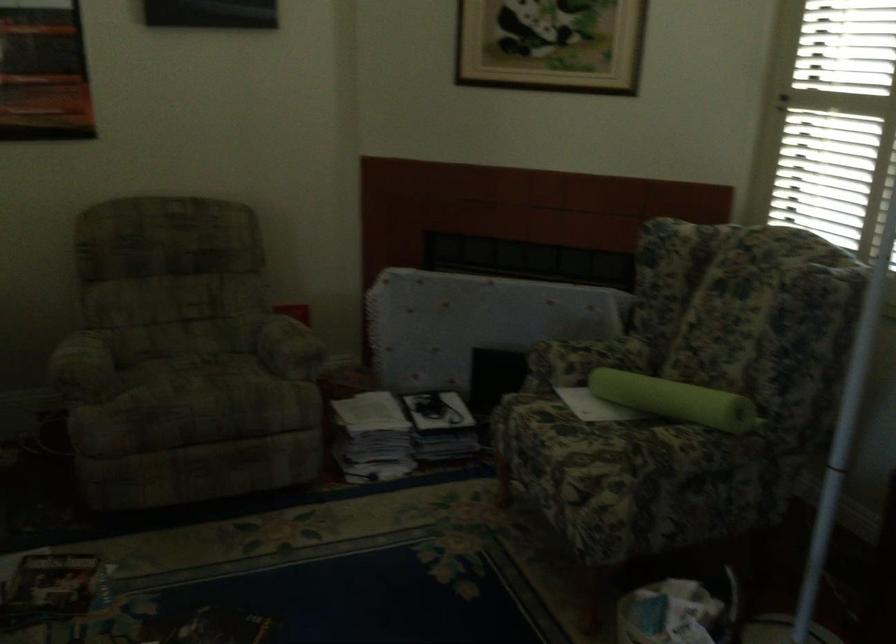
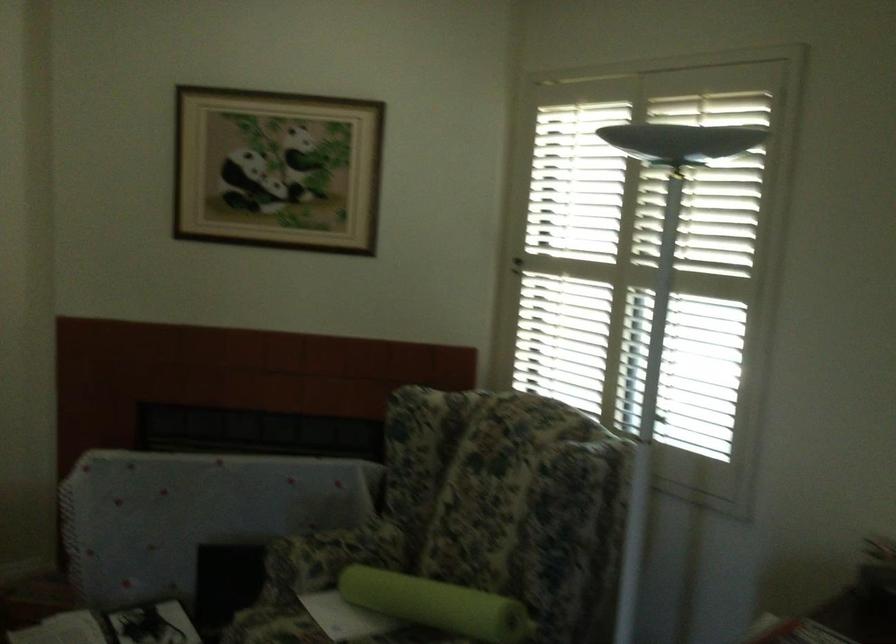
Question: The camera is either moving clockwise (left) or counter-clockwise (right) around the object. The first image is from the beginning of the video and the second image is from the end. Is the camera moving left or right when shooting the video?

Choices:
 (A) Left
 (B) Right

Answer: (A)